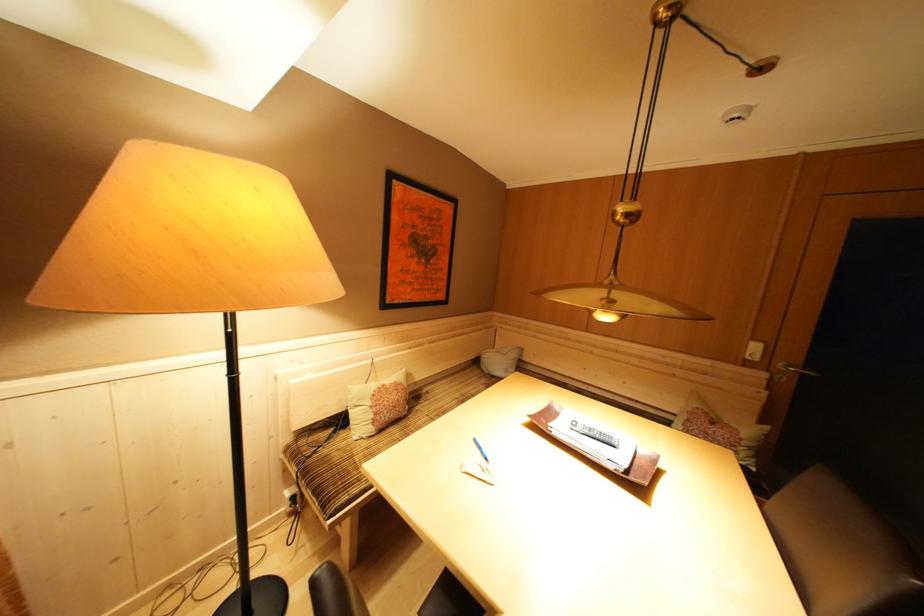
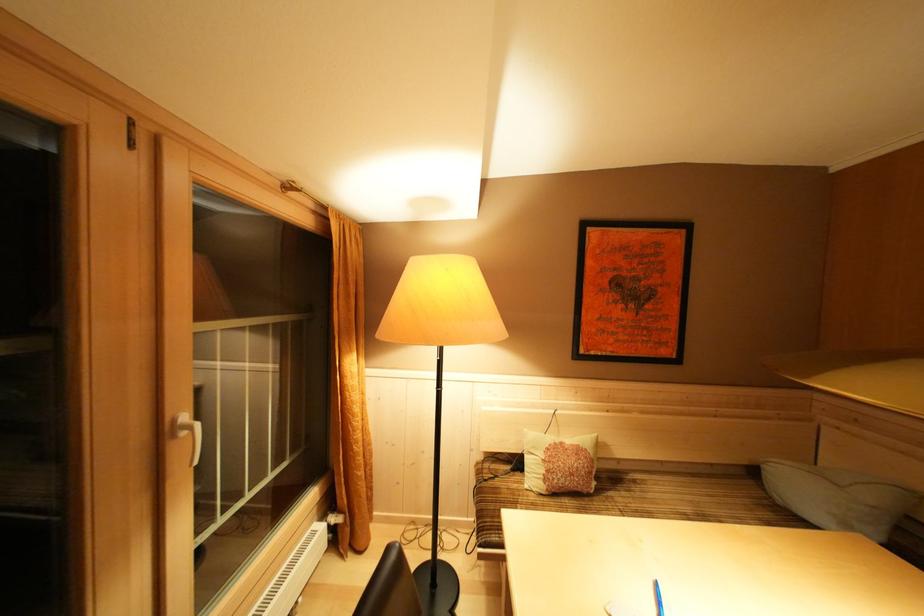
Locate, in the second image, the point that corresponds to pixel 390 391 in the first image.

(568, 448)